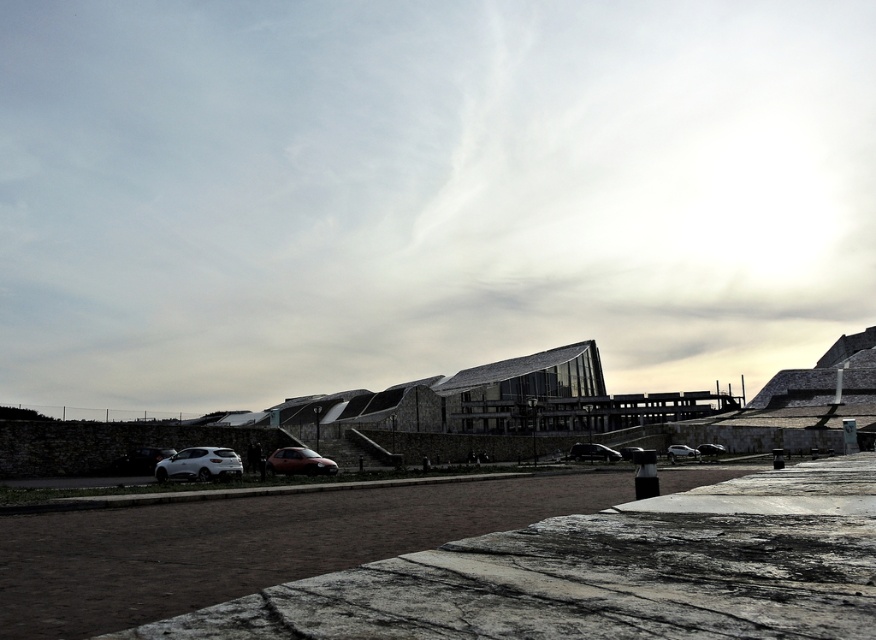
You are standing in front of the modern architectural structure and want to move to the road behind the cars. Which car should you walk around to reach the road? The matte red car at center or the matte silver sedan at center?

You should walk around the matte red car at center because it is closer to the viewer, so it is in front of the matte silver sedan at center. To reach the road behind, you need to go around the closer matte red car at center first.

You are a parking attendant trying to fit a new vehicle into the space between the matte red car at center and the matte silver sedan at center. The new vehicle is 1.8 meters wide. Can you determine if there is enough space between them to accommodate the new vehicle?

The matte red car at center is narrower than the matte silver sedan at center. However, the exact distance between them isn t specified in the provided information. Without knowing the actual space between the cars, it s impossible to confirm if the 1.8 meter wide vehicle will fit. Please measure the gap physically or refer to parking guidelines.